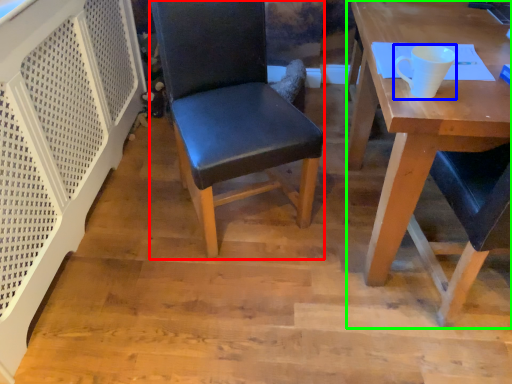
Question: Which is farther away from chair (highlighted by a red box)? coffee cup (highlighted by a blue box) or desk (highlighted by a green box)?

Choices:
 (A) coffee cup
 (B) desk

Answer: (A)